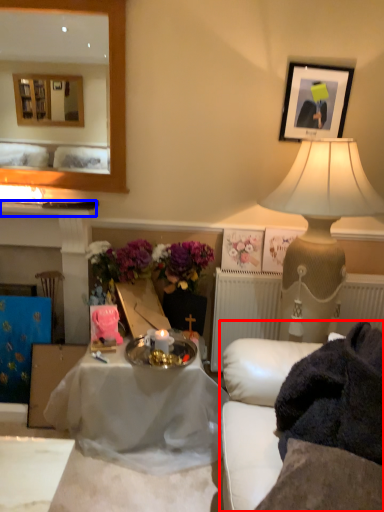
Question: Which object is further to the camera taking this photo, studio couch (highlighted by a red box) or mantle (highlighted by a blue box)?

Choices:
 (A) studio couch
 (B) mantle

Answer: (B)